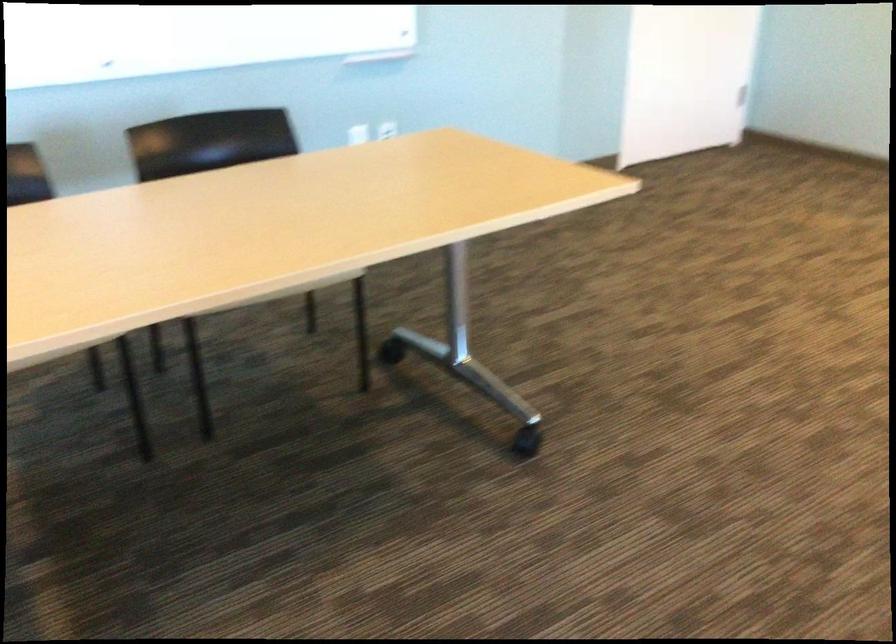
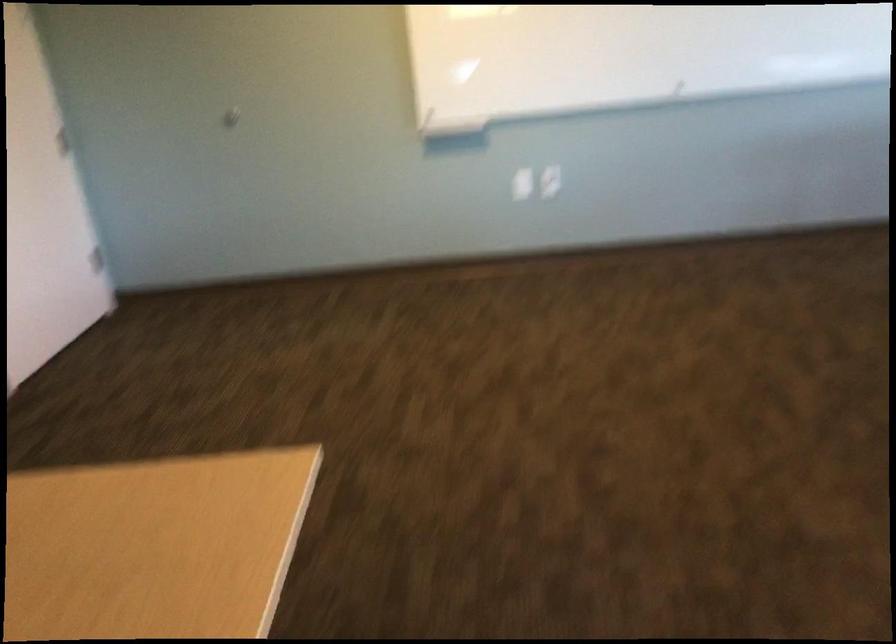
Question: Based on the continuous images, in which direction is the camera rotating? Reply with the corresponding letter.

Choices:
 (A) Left
 (B) Right
 (C) Up
 (D) Down

Answer: (B)